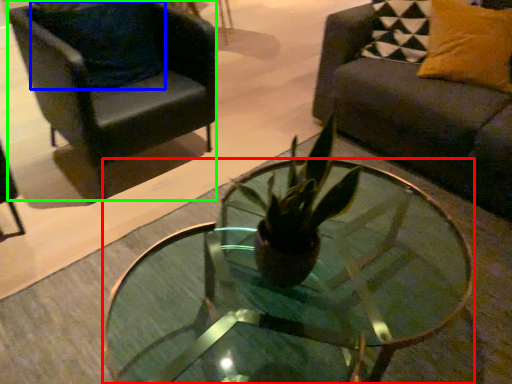
Question: Which is farther away from coffee table (highlighted by a red box)? pillow (highlighted by a blue box) or chair (highlighted by a green box)?

Choices:
 (A) pillow
 (B) chair

Answer: (A)